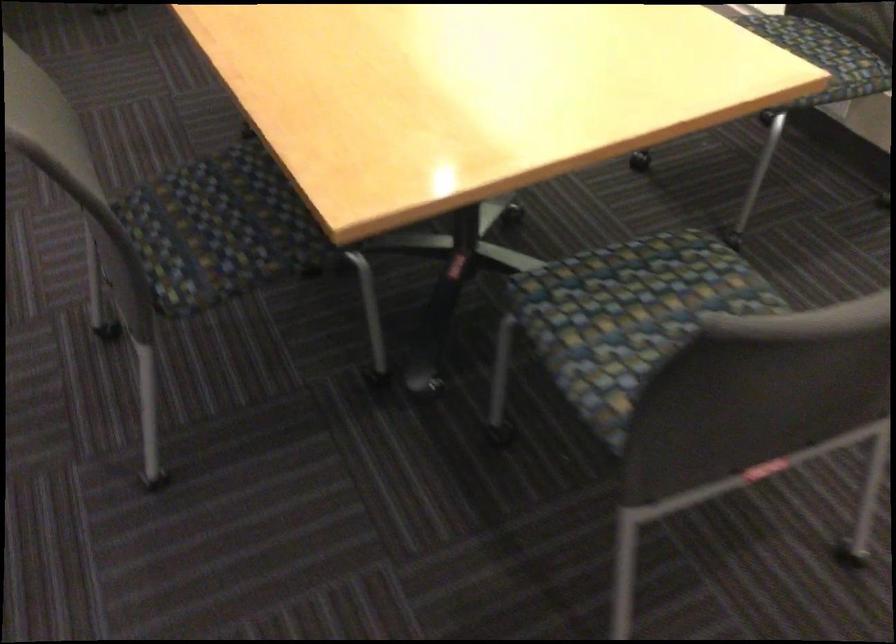
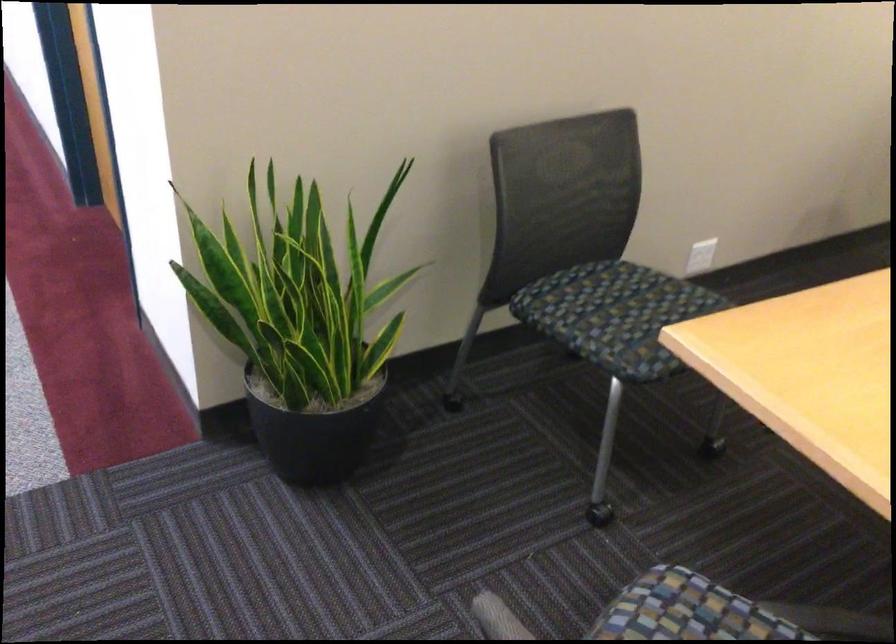
From the picture: What movement of the cameraman would produce the second image?

The movement direction of the cameraman is left, forward.